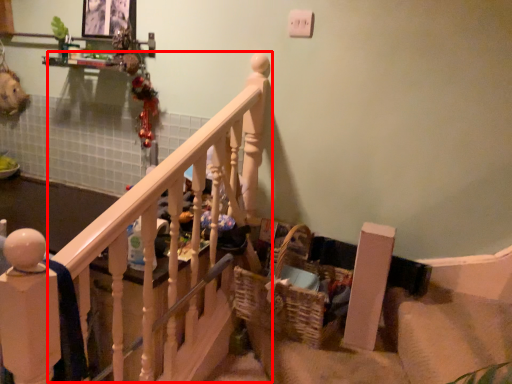
Question: In this image, where is rail (annotated by the red box) located relative to basket?

Choices:
 (A) left
 (B) right

Answer: (A)